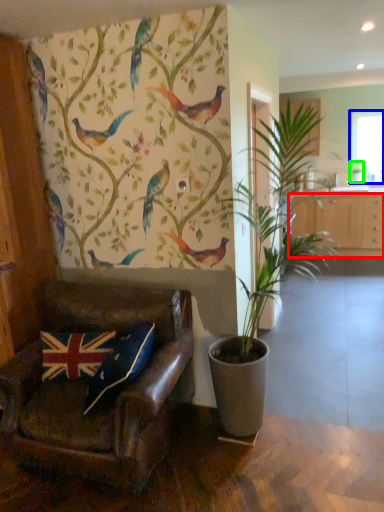
Question: Based on their relative distances, which object is nearer to cabinetry (highlighted by a red box)? Choose from window screen (highlighted by a blue box) and houseplant (highlighted by a green box).

Choices:
 (A) window screen
 (B) houseplant

Answer: (B)